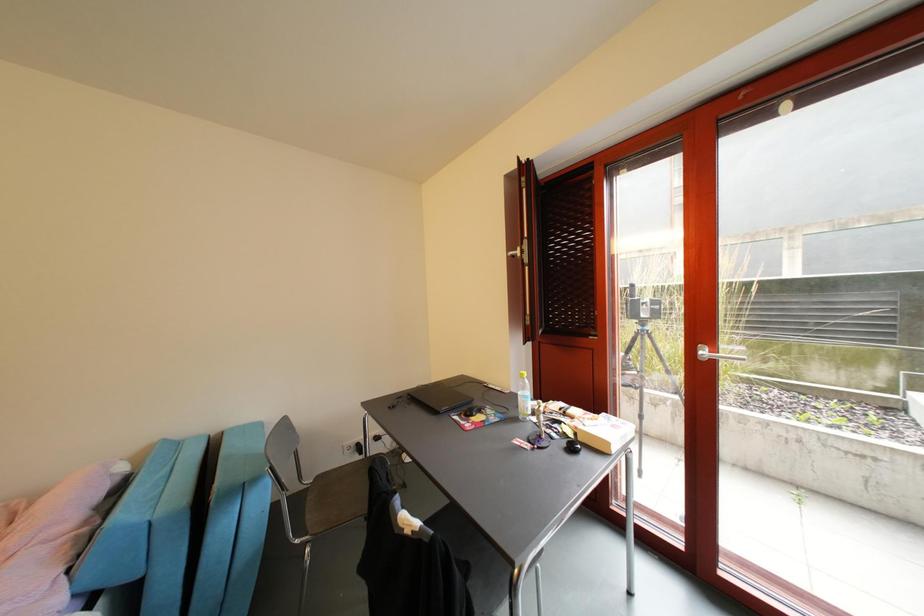
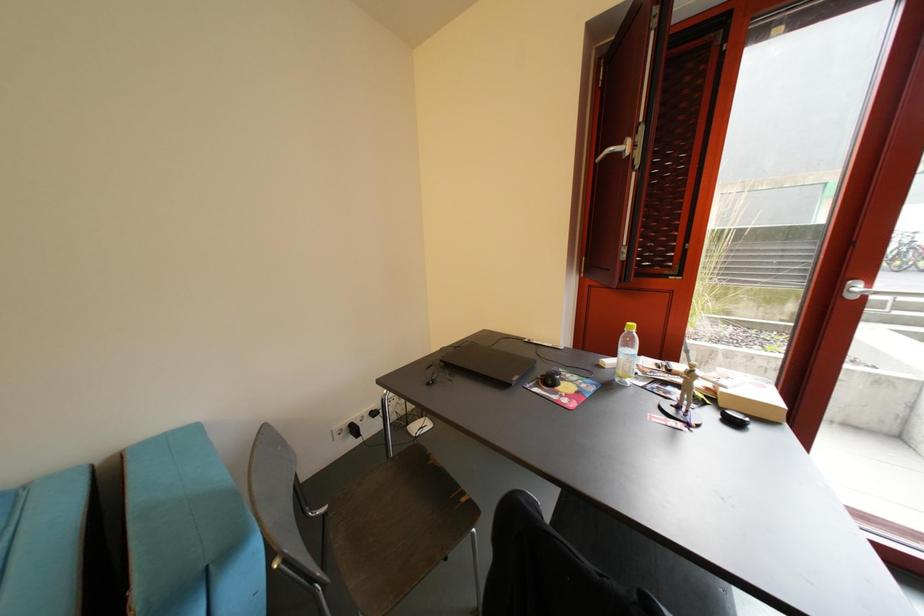
Which direction would the cameraman need to move to produce the second image?

The movement direction of the cameraman is left, forward.